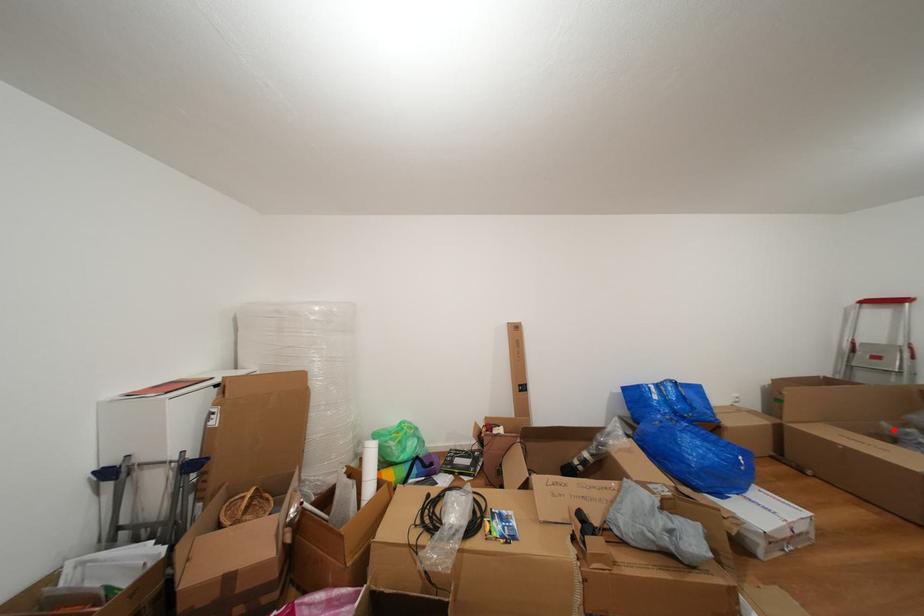
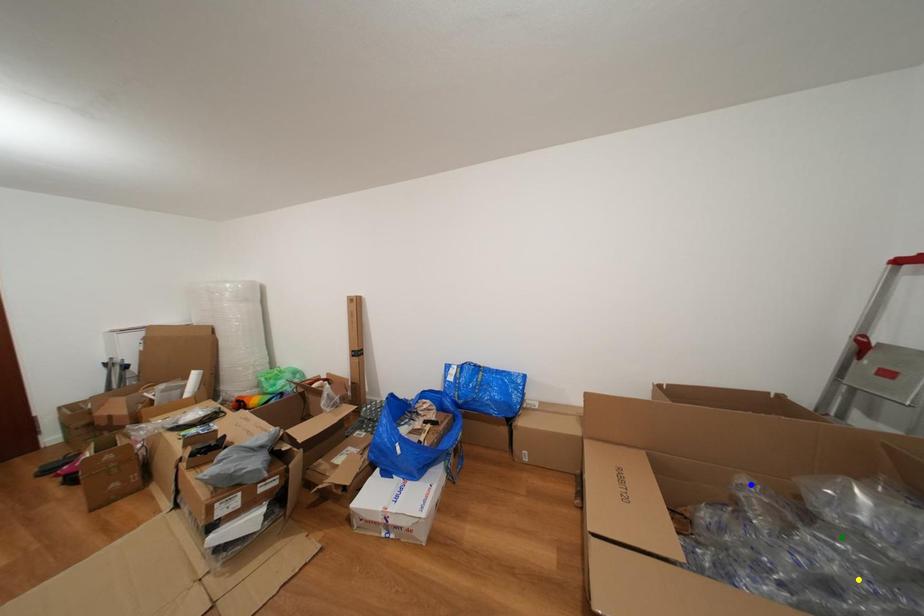
Question: I am providing you with two images of the same scene from different viewpoints. A red point is marked on the first image. You are given multiple points on the second image. Which spot in image 2 lines up with the point in image 1?

Choices:
 (A) green point
 (B) yellow point
 (C) blue point

Answer: (C)